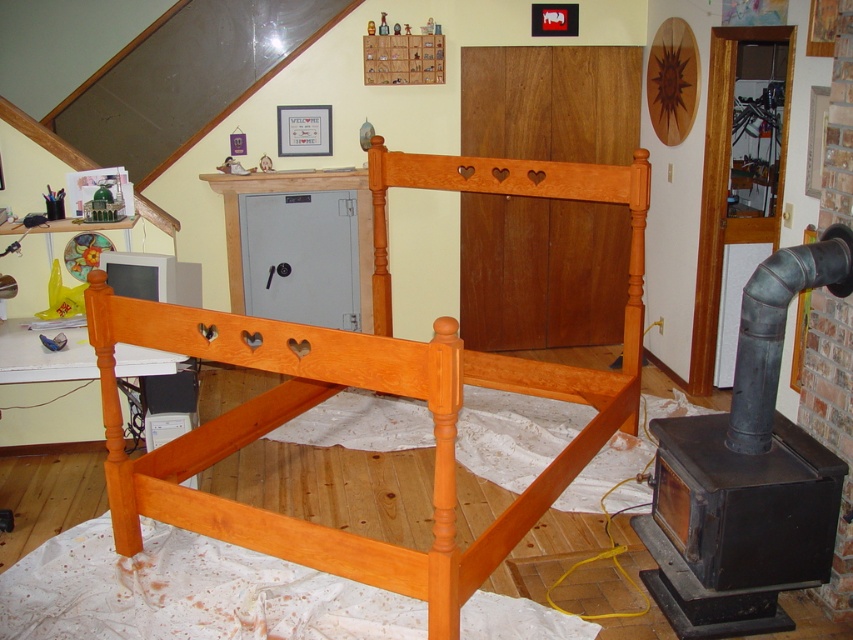
You are setting up a new bunk bed in a rustic room. The room already has a cherry wood headboard at center. Where should you place the cherry wood bunk bed at center relative to the headboard to match the existing decor?

The cherry wood bunk bed at center should be placed to the left of the cherry wood headboard at center to align with the existing decor.

Based on the photo, you are a parent setting up a child room and see the cherry wood bunk bed at center and the cherry wood headboard at center. Which one is positioned lower in the room?

The cherry wood bunk bed at center is positioned lower than the cherry wood headboard at center.

You are standing in a room and see the cherry wood bunk bed at center. If you want to reach a book on a shelf that is 8 feet away from you, can you stretch your arm to grab it without moving your feet?

The cherry wood bunk bed at center is 7.73 feet away from viewer, so if the book is 8 feet away, it is slightly farther than the distance to the bunk bed. You may need to take a small step forward to reach it.